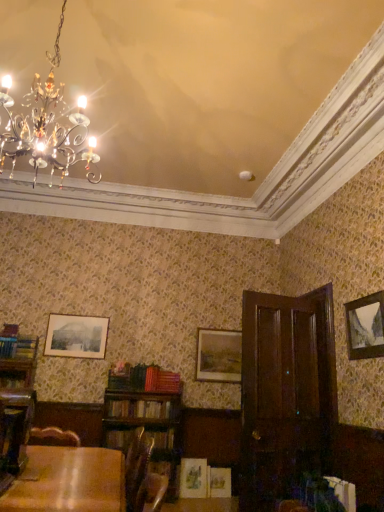
Question: Is white paper book at lower right, which is the 1th book in front-to-back order, bigger than hardcover book at lower left, the 4th book positioned from the right?

Choices:
 (A) yes
 (B) no

Answer: (A)

Question: From a real-world perspective, is white paper book at lower right, which is counted as the 1th book, starting from the right, located beneath hardcover book at lower left, marked as the third book in a front-to-back arrangement?

Choices:
 (A) yes
 (B) no

Answer: (A)

Question: Is white paper book at lower right, which is the 1th book in front-to-back order, further to the viewer compared to hardcover book at lower left, which is counted as the 2th book, starting from the back?

Choices:
 (A) yes
 (B) no

Answer: (B)

Question: Is white paper book at lower right, which is the 1th book in front-to-back order, completely or partially outside of hardcover book at lower left, which is counted as the 2th book, starting from the back?

Choices:
 (A) yes
 (B) no

Answer: (A)

Question: Considering the relative positions of white paper book at lower right, which is counted as the 1th book, starting from the right, and hardcover book at lower left, which is counted as the 2th book, starting from the back, in the image provided, is white paper book at lower right, which is counted as the 1th book, starting from the right, to the left of hardcover book at lower left, which is counted as the 2th book, starting from the back, from the viewer's perspective?

Choices:
 (A) no
 (B) yes

Answer: (A)

Question: Considering the positions of hardcover book at center, which is the third book in back-to-front order, and wooden table at lower left in the image, is hardcover book at center, which is the third book in back-to-front order, taller or shorter than wooden table at lower left?

Choices:
 (A) short
 (B) tall

Answer: (A)

Question: From the image's perspective, relative to wooden table at lower left, is hardcover book at center, the 3th book viewed from the right, above or below?

Choices:
 (A) above
 (B) below

Answer: (B)

Question: Would you say hardcover book at center, acting as the second book starting from the left, is to the left or to the right of wooden table at lower left in the picture?

Choices:
 (A) right
 (B) left

Answer: (B)

Question: In the image, is hardcover book at center, acting as the second book starting from the left, positioned in front of or behind wooden table at lower left?

Choices:
 (A) behind
 (B) front

Answer: (A)

Question: Is point (357, 317) closer or farther from the camera than point (102, 339)?

Choices:
 (A) farther
 (B) closer

Answer: (B)

Question: Visually, is wooden picture frame at right, the 3th picture frame in the left-to-right sequence, positioned to the left or to the right of matte black picture frame at upper left, placed as the 2th picture frame when sorted from back to front?

Choices:
 (A) right
 (B) left

Answer: (A)

Question: In terms of width, does wooden picture frame at right, acting as the 1th picture frame starting from the right, look wider or thinner when compared to matte black picture frame at upper left, acting as the first picture frame starting from the left?

Choices:
 (A) thin
 (B) wide

Answer: (B)

Question: Is wooden picture frame at right, which is the 1th picture frame in front-to-back order, situated inside matte black picture frame at upper left, which ranks as the third picture frame in right-to-left order, or outside?

Choices:
 (A) inside
 (B) outside

Answer: (B)

Question: Does point pos(261,441) appear closer or farther from the camera than point pos(84,333)?

Choices:
 (A) closer
 (B) farther

Answer: (A)

Question: Relative to matte black picture frame at upper left, which ranks as the second picture frame in front-to-back order, is dark wood armoire at right in front or behind?

Choices:
 (A) behind
 (B) front

Answer: (B)